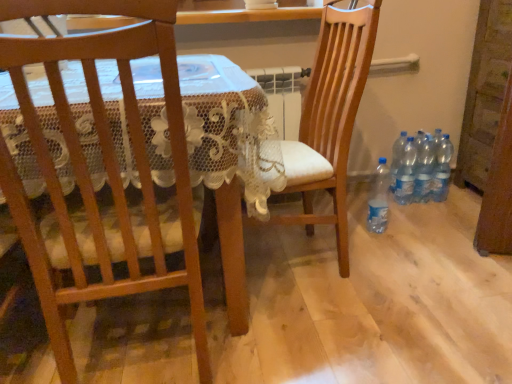
Image resolution: width=512 pixels, height=384 pixels. Identify the location of free space between clear plastic bottle at lower right, which appears as the 5th bottle when viewed from the right, and clear plastic bottles at lower right, which is counted as the 4th bottle, starting from the left. (400, 214).